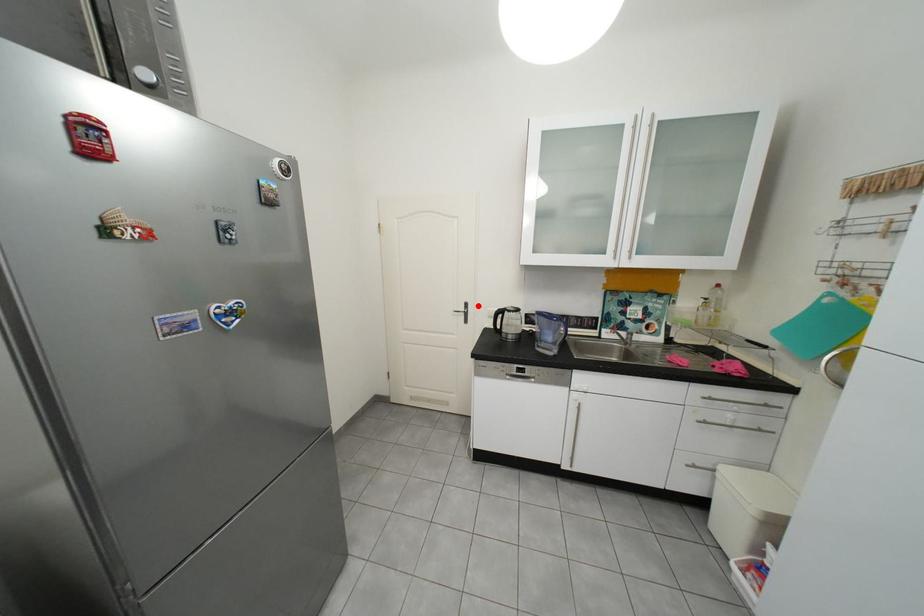
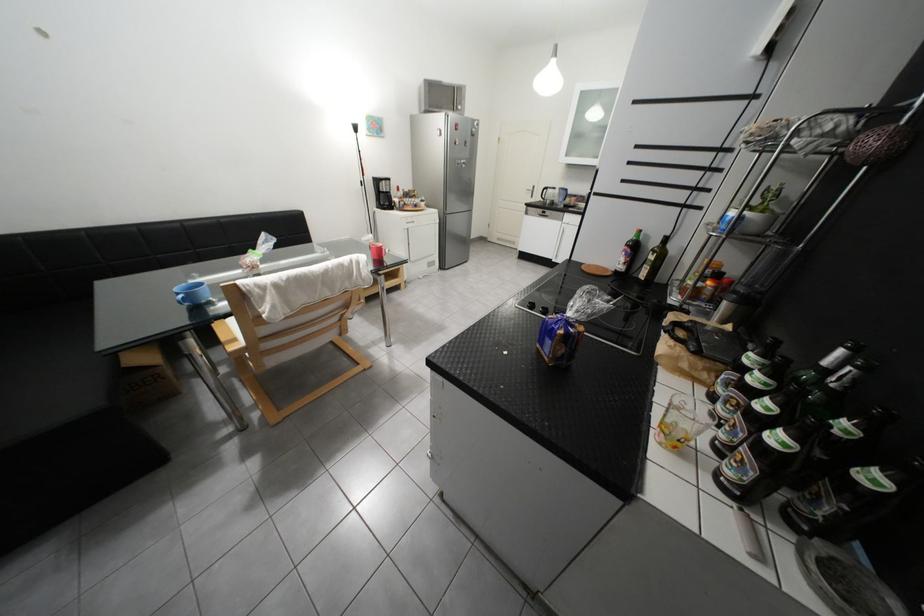
Where in the second image is the point corresponding to the highlighted location from the first image?

(545, 188)